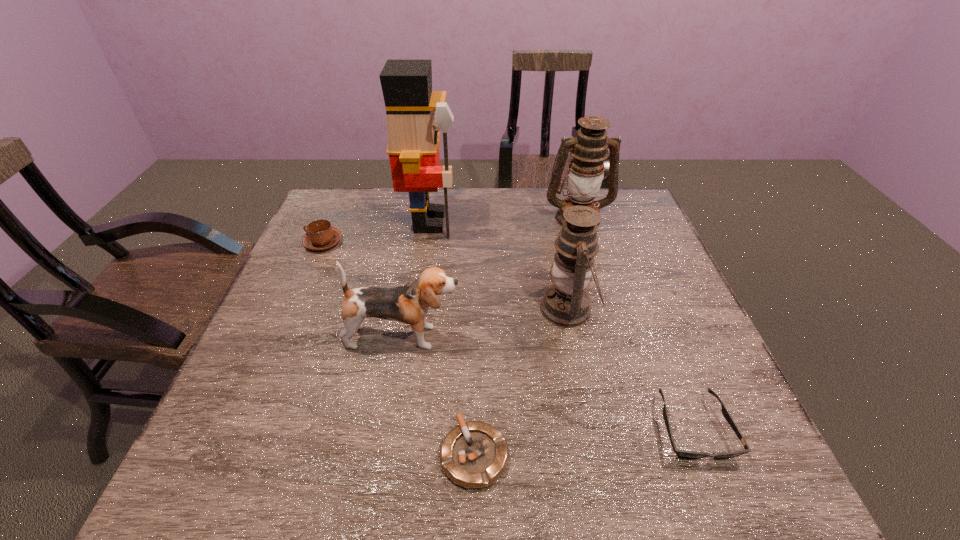
Locate an element on the screen. The height and width of the screenshot is (540, 960). blank space located 0.290m on the back of the nearer oil lamp is located at coordinates (550, 220).

Where is `free space located at the face of the fourth tallest object`? This screenshot has height=540, width=960. free space located at the face of the fourth tallest object is located at coordinates (603, 337).

Locate an element on the screen. vacant space located on the back of the ashtray is located at coordinates (476, 310).

Find the location of a particular element. nutcracker that is at the far edge is located at coordinates (413, 126).

Locate an element on the screen. The image size is (960, 540). lantern that is at the far edge is located at coordinates (589, 149).

I want to click on sunglasses that is at the near edge, so click(686, 454).

The height and width of the screenshot is (540, 960). I want to click on ashtray present at the near edge, so click(x=474, y=454).

Find the location of a particular element. object located at the left edge is located at coordinates (320, 235).

The image size is (960, 540). In order to click on lantern that is positioned at the right edge in this screenshot , I will do `click(589, 149)`.

Find the location of `sunglasses that is at the right edge`. sunglasses that is at the right edge is located at coordinates (686, 454).